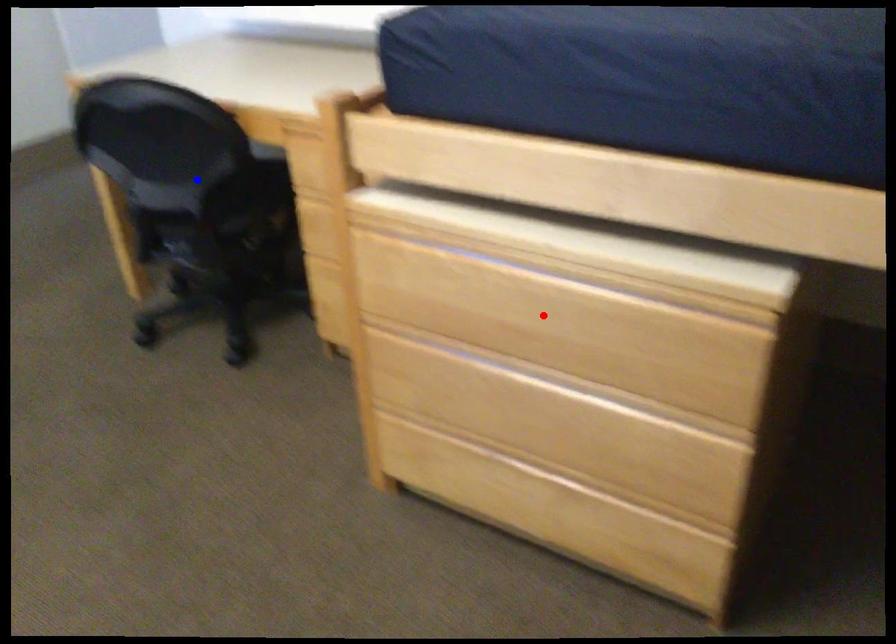
Question: In the image, two points are highlighted. Which point is nearer to the camera? Reply with the corresponding letter.

Choices:
 (A) blue point
 (B) red point

Answer: (B)